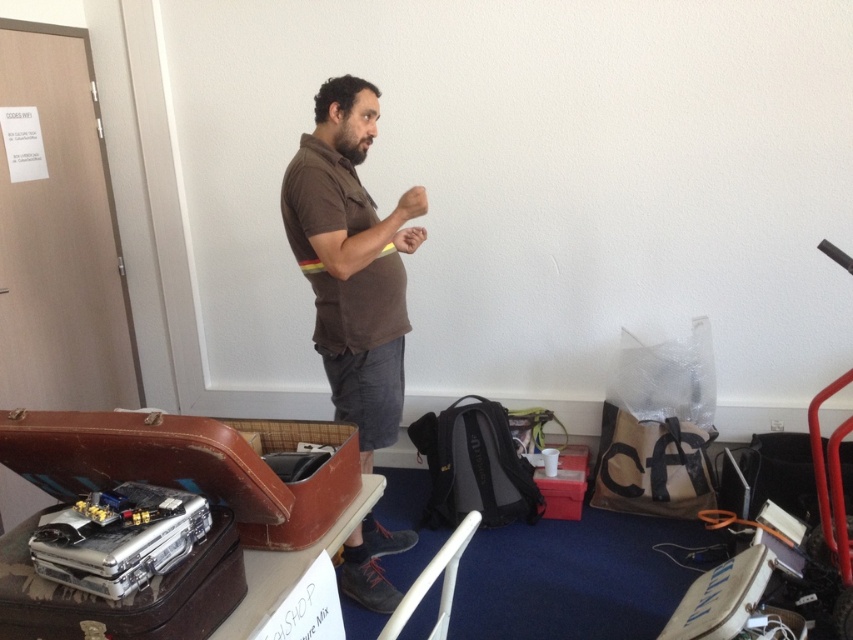
Where is the brown cotton shirt at center located in the image?

The brown cotton shirt at center is located at the 2D coordinates point (x=352, y=260) in the image.

You are standing at the point with coordinates point (149, 627) in the room. You want to walk straight towards the point with coordinates point (402, 209). Will you pass through the man who is standing near the center of the room?

Point (402, 209) is behind point (149, 627), so walking straight towards it would mean moving away from the man, so you won not pass through him.

You are a delivery person who needs to place a package on the floor between the brown cotton shirt at center and the silver metallic briefcase at lower left. Which object should you move to make space?

The brown cotton shirt at center is taller than the silver metallic briefcase at lower left. You should move the silver metallic briefcase at lower left because it is shorter and easier to relocate to create space for the package.